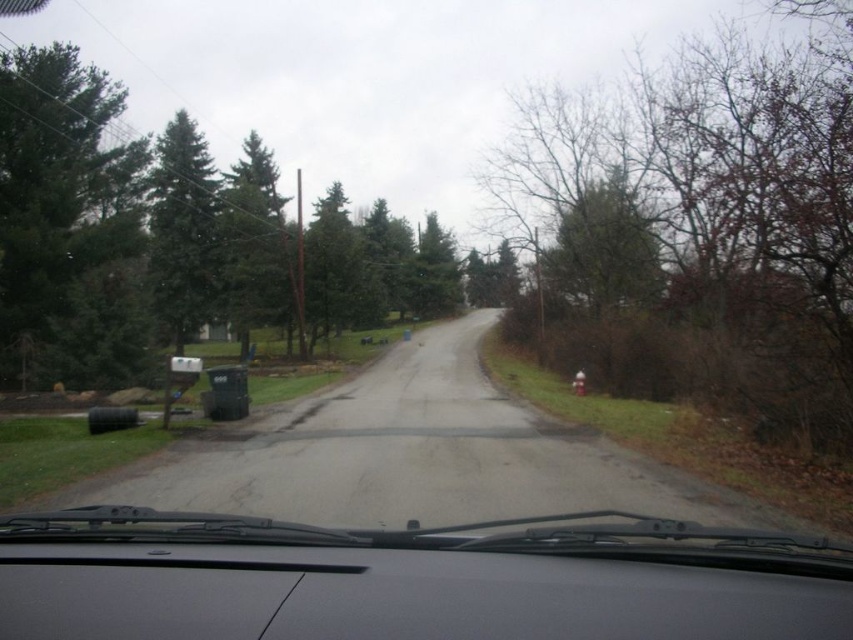
You are driving a car and notice a point of interest at coordinates (700, 228). What can be found at that location?

At point (700, 228) lies bare branches at right.

You are sitting in the driver seat of the car and want to check if you can safely open the car door without hitting the black matte windshield wipers at center. The car door opening requires 0.5 meters of space. Is there enough space?

The black matte windshield wipers at center and viewer are 6.99 meters apart from each other. Since the required space to open the door is only 0.5 meters, there is more than enough space to safely open the car door without hitting the black matte windshield wipers at center.

You are driving a car and see two points on the road ahead. The first point is at coordinate point(281, 528) and the second point is at coordinate point(157, 150). Which point is closer to your current position?

Point(281, 528) is in front of point(157, 150), so the closer point to your current position is point(157, 150).